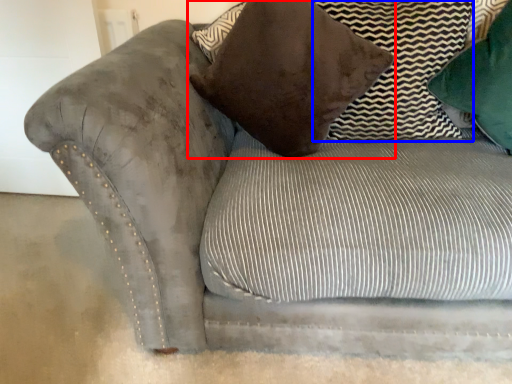
Question: Which object appears closest to the camera in this image, pillow (highlighted by a red box) or pillow (highlighted by a blue box)?

Choices:
 (A) pillow
 (B) pillow

Answer: (A)